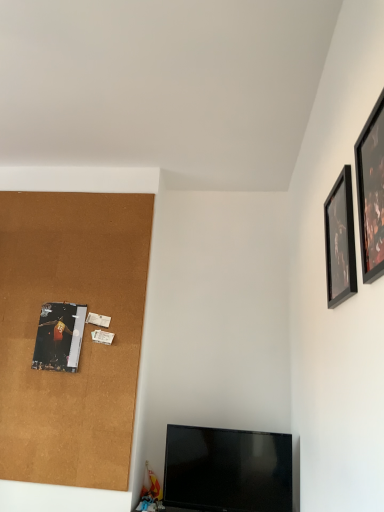
What do you see at coordinates (340, 241) in the screenshot? The width and height of the screenshot is (384, 512). I see `black matte picture frame at upper right, positioned as the 1th picture frame in right-to-left order` at bounding box center [340, 241].

How much space does black matte picture frame at upper right, positioned as the 1th picture frame in right-to-left order, occupy vertically?

45.06 centimeters.

What do you see at coordinates (227, 470) in the screenshot? This screenshot has height=512, width=384. I see `black glossy tv at lower center` at bounding box center [227, 470].

This screenshot has width=384, height=512. What are the coordinates of `cork board at left` in the screenshot? It's located at (83, 336).

What do you see at coordinates (59, 337) in the screenshot?
I see `metallic silver poster at left, the 1th picture frame when ordered from left to right` at bounding box center [59, 337].

You are a GUI agent. You are given a task and a screenshot of the screen. Output one action in this format:
    pyautogui.click(x=<x>, y=<y>)
    Task: Click on the black matte picture frame at upper right, placed as the third picture frame when sorted from left to right
    
    Given the screenshot: What is the action you would take?
    pyautogui.click(x=340, y=241)

Could you tell me if black matte picture frame at upper right, positioned as the 1th picture frame in right-to-left order, is turned towards black glossy tv at lower center?

No.

Identify the location of television below the black matte picture frame at upper right, placed as the 2th picture frame when sorted from back to front (from a real-world perspective). coord(227,470).

Would you consider black matte picture frame at upper right, placed as the third picture frame when sorted from left to right, to be distant from black glossy tv at lower center?

Yes, black matte picture frame at upper right, placed as the third picture frame when sorted from left to right, and black glossy tv at lower center are located far from each other.

Which of these two, cork board at left or black glossy tv at lower center, stands taller?

With more height is cork board at left.

Find the location of a particular element. The width and height of the screenshot is (384, 512). television to the right of cork board at left is located at coordinates (227, 470).

Is point (13, 437) positioned in front of point (276, 505)?

No, it is not.

From a real-world perspective, is cork board at left positioned under black glossy tv at lower center based on gravity?

Actually, cork board at left is physically above black glossy tv at lower center in the real world.

Considering the positions of points (363, 127) and (289, 456), is point (363, 127) farther from camera compared to point (289, 456)?

No.

Looking at this image, relative to black glossy tv at lower center, is black glossy picture frame at upper right, which ranks as the third picture frame in back-to-front order, in front or behind?

black glossy picture frame at upper right, which ranks as the third picture frame in back-to-front order, is in front of black glossy tv at lower center.

Can you confirm if black glossy picture frame at upper right, which ranks as the third picture frame in back-to-front order, is positioned to the left of black glossy tv at lower center?

In fact, black glossy picture frame at upper right, which ranks as the third picture frame in back-to-front order, is to the right of black glossy tv at lower center.

Identify the location of television below the black glossy picture frame at upper right, which ranks as the 2th picture frame in left-to-right order (from a real-world perspective). (227, 470).

Where is `the 2nd picture frame below when counting from the black glossy picture frame at upper right, which ranks as the 2th picture frame in left-to-right order (from the image's perspective)`? the 2nd picture frame below when counting from the black glossy picture frame at upper right, which ranks as the 2th picture frame in left-to-right order (from the image's perspective) is located at coordinates (59, 337).

Which is behind, black glossy picture frame at upper right, which ranks as the 2th picture frame in left-to-right order, or metallic silver poster at left, the 1th picture frame when ordered from left to right?

metallic silver poster at left, the 1th picture frame when ordered from left to right, is behind.

From a real-world perspective, which is physically below, black glossy picture frame at upper right, the first picture frame in the front-to-back sequence, or metallic silver poster at left, which appears as the 3th picture frame when viewed from the right?

metallic silver poster at left, which appears as the 3th picture frame when viewed from the right, from a real-world perspective.

Is black glossy picture frame at upper right, which ranks as the third picture frame in back-to-front order, inside the boundaries of metallic silver poster at left, the 1th picture frame when ordered from left to right, or outside?

black glossy picture frame at upper right, which ranks as the third picture frame in back-to-front order, lies outside metallic silver poster at left, the 1th picture frame when ordered from left to right.

Is cork board at left taller or shorter than metallic silver poster at left, which is counted as the 1th picture frame, starting from the back?

cork board at left is taller than metallic silver poster at left, which is counted as the 1th picture frame, starting from the back.

In terms of size, does cork board at left appear bigger or smaller than metallic silver poster at left, which appears as the 3th picture frame when viewed from the right?

Considering their sizes, cork board at left takes up more space than metallic silver poster at left, which appears as the 3th picture frame when viewed from the right.

From a real-world perspective, is cork board at left physically above metallic silver poster at left, the third picture frame positioned from the front?

Correct, in the physical world, cork board at left is higher than metallic silver poster at left, the third picture frame positioned from the front.

Which is behind, cork board at left or black matte picture frame at upper right, the 2th picture frame viewed from the front?

cork board at left.

Is cork board at left taller than black matte picture frame at upper right, placed as the third picture frame when sorted from left to right?

Yes.

Which of these two, cork board at left or black matte picture frame at upper right, placed as the 2th picture frame when sorted from back to front, is smaller?

With smaller size is black matte picture frame at upper right, placed as the 2th picture frame when sorted from back to front.

Is cork board at left facing towards black matte picture frame at upper right, placed as the 2th picture frame when sorted from back to front?

No, cork board at left is not facing towards black matte picture frame at upper right, placed as the 2th picture frame when sorted from back to front.

Does metallic silver poster at left, the third picture frame positioned from the front, lie in front of black glossy tv at lower center?

No, the depth of metallic silver poster at left, the third picture frame positioned from the front, is greater than that of black glossy tv at lower center.

From a real-world perspective, is metallic silver poster at left, the third picture frame positioned from the front, positioned over black glossy tv at lower center based on gravity?

Yes.

Can you confirm if metallic silver poster at left, which is counted as the 1th picture frame, starting from the back, is shorter than black glossy tv at lower center?

Yes.

Find the location of a particular element. This screenshot has height=512, width=384. television below the black matte picture frame at upper right, positioned as the 1th picture frame in right-to-left order (from a real-world perspective) is located at coordinates (227, 470).

You are a GUI agent. You are given a task and a screenshot of the screen. Output one action in this format:
    pyautogui.click(x=<x>, y=<y>)
    Task: Click on the plywood that appears behind the black glossy tv at lower center
    This screenshot has width=384, height=512.
    Given the screenshot: What is the action you would take?
    click(83, 336)

Estimate the real-world distances between objects in this image. Which object is closer to black glossy tv at lower center, black glossy picture frame at upper right, which ranks as the 2th picture frame in left-to-right order, or cork board at left?

cork board at left.

Based on their spatial positions, is black glossy picture frame at upper right, which ranks as the third picture frame in back-to-front order, or cork board at left further from black matte picture frame at upper right, the 2th picture frame viewed from the front?

cork board at left is positioned further to the anchor black matte picture frame at upper right, the 2th picture frame viewed from the front.

When comparing their distances from black matte picture frame at upper right, placed as the 2th picture frame when sorted from back to front, does black glossy tv at lower center or cork board at left seem closer?

black glossy tv at lower center is closer to black matte picture frame at upper right, placed as the 2th picture frame when sorted from back to front.

In the scene shown: When comparing their distances from black glossy tv at lower center, does black glossy picture frame at upper right, which ranks as the third picture frame in back-to-front order, or metallic silver poster at left, which appears as the 3th picture frame when viewed from the right, seem closer?

metallic silver poster at left, which appears as the 3th picture frame when viewed from the right, is positioned closer to the anchor black glossy tv at lower center.

Based on their spatial positions, is cork board at left or metallic silver poster at left, the 1th picture frame when ordered from left to right, further from black matte picture frame at upper right, placed as the 2th picture frame when sorted from back to front?

metallic silver poster at left, the 1th picture frame when ordered from left to right.

When comparing their distances from cork board at left, does black glossy picture frame at upper right, which ranks as the third picture frame in back-to-front order, or black glossy tv at lower center seem further?

black glossy picture frame at upper right, which ranks as the third picture frame in back-to-front order.

When comparing their distances from metallic silver poster at left, which appears as the 3th picture frame when viewed from the right, does black glossy tv at lower center or black glossy picture frame at upper right, which ranks as the 2th picture frame in left-to-right order, seem closer?

black glossy tv at lower center is positioned closer to the anchor metallic silver poster at left, which appears as the 3th picture frame when viewed from the right.

Estimate the real-world distances between objects in this image. Which object is closer to metallic silver poster at left, which appears as the 3th picture frame when viewed from the right, black matte picture frame at upper right, placed as the 2th picture frame when sorted from back to front, or black glossy picture frame at upper right, which ranks as the third picture frame in back-to-front order?

black matte picture frame at upper right, placed as the 2th picture frame when sorted from back to front, is positioned closer to the anchor metallic silver poster at left, which appears as the 3th picture frame when viewed from the right.

The width and height of the screenshot is (384, 512). In order to click on plywood between black glossy picture frame at upper right, which ranks as the 2th picture frame in left-to-right order, and metallic silver poster at left, the 1th picture frame when ordered from left to right, in the front-back direction in this screenshot , I will do `click(83, 336)`.

Locate an element on the screen. This screenshot has width=384, height=512. television between black glossy picture frame at upper right, which is the 2th picture frame from right to left, and cork board at left, along the z-axis is located at coordinates (227, 470).

This screenshot has width=384, height=512. I want to click on television between black glossy picture frame at upper right, the first picture frame in the front-to-back sequence, and metallic silver poster at left, the 1th picture frame when ordered from left to right, in the front-back direction, so click(x=227, y=470).

Locate an element on the screen. This screenshot has width=384, height=512. television situated between cork board at left and black matte picture frame at upper right, positioned as the 1th picture frame in right-to-left order, from left to right is located at coordinates (227, 470).